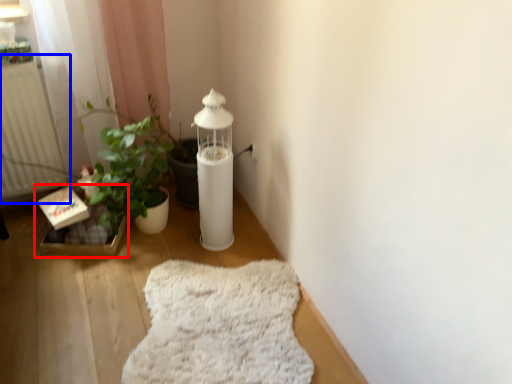
Question: Which of the following is the farthest to the observer, window sill (highlighted by a red box) or radiator (highlighted by a blue box)?

Choices:
 (A) window sill
 (B) radiator

Answer: (A)